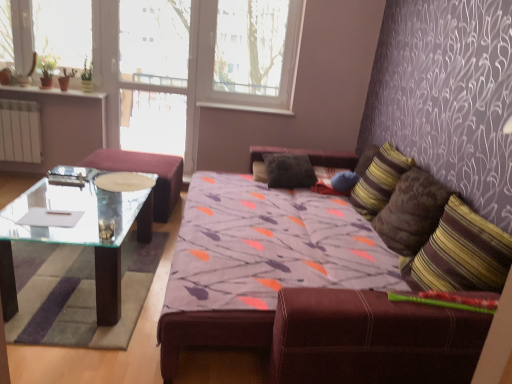
The image size is (512, 384). Find the location of `free point above white plastic window sill at upper center (from a real-world perspective)`. free point above white plastic window sill at upper center (from a real-world perspective) is located at coordinates (241, 99).